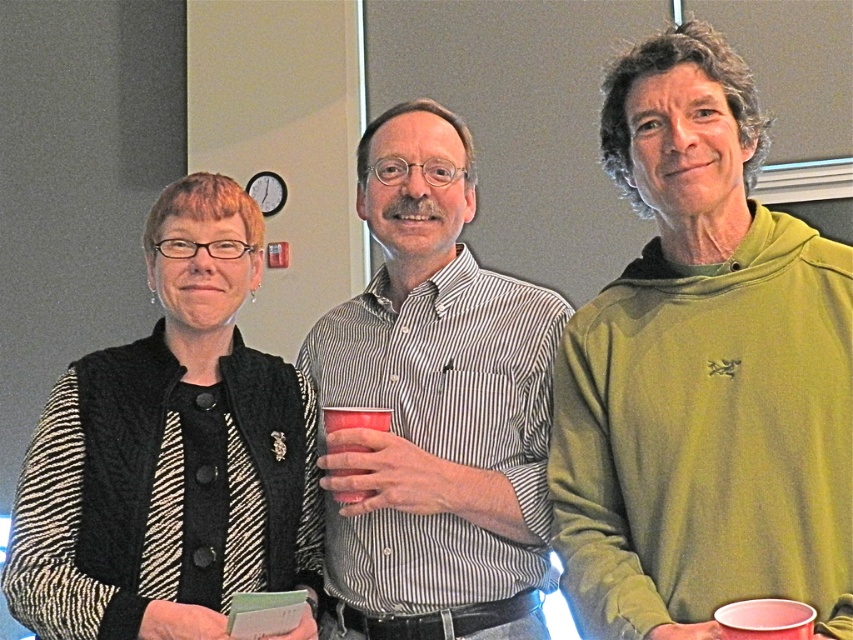
You are a fashion designer observing this scene. You need to determine which item has a narrower width between the black knitted vest at left and the white striped shirt at center. Which one is narrower?

The black knitted vest at left is thinner than the white striped shirt at center, so the black knitted vest at left has a narrower width.

Based on the photo, you are standing in the room and see the point marked at coordinates (701, 372). What object is located at that point?

The point at coordinates (701, 372) indicates the green hoodie at center.